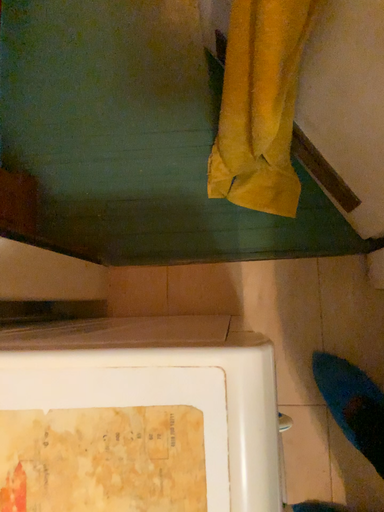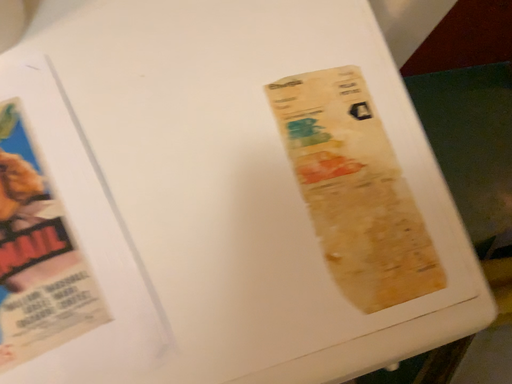
Question: How did the camera likely rotate when shooting the video?

Choices:
 (A) rotated upward
 (B) rotated downward

Answer: (A)